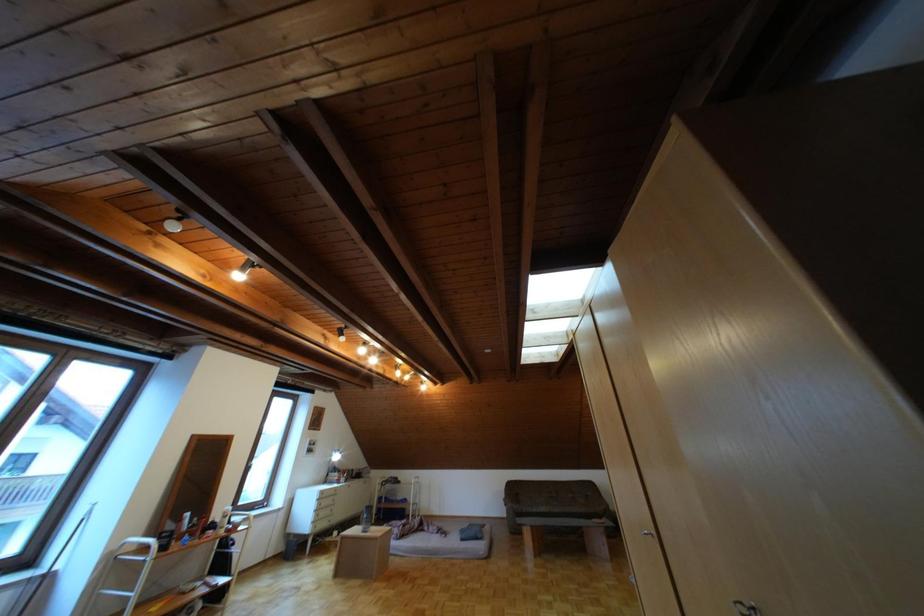
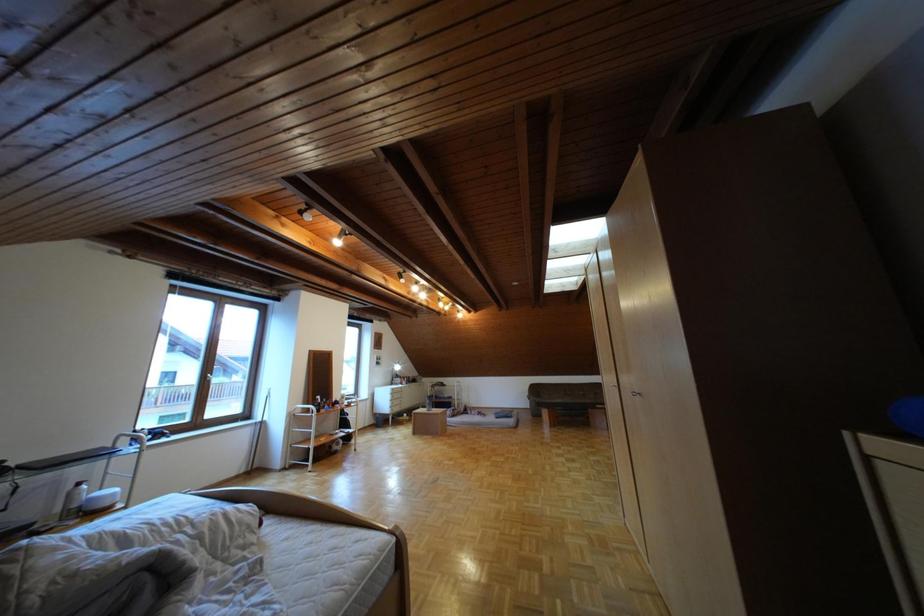
Question: The images are taken continuously from a first-person perspective. In which direction are you moving?

Choices:
 (A) Left
 (B) Right
 (C) Forward
 (D) Backward

Answer: (D)